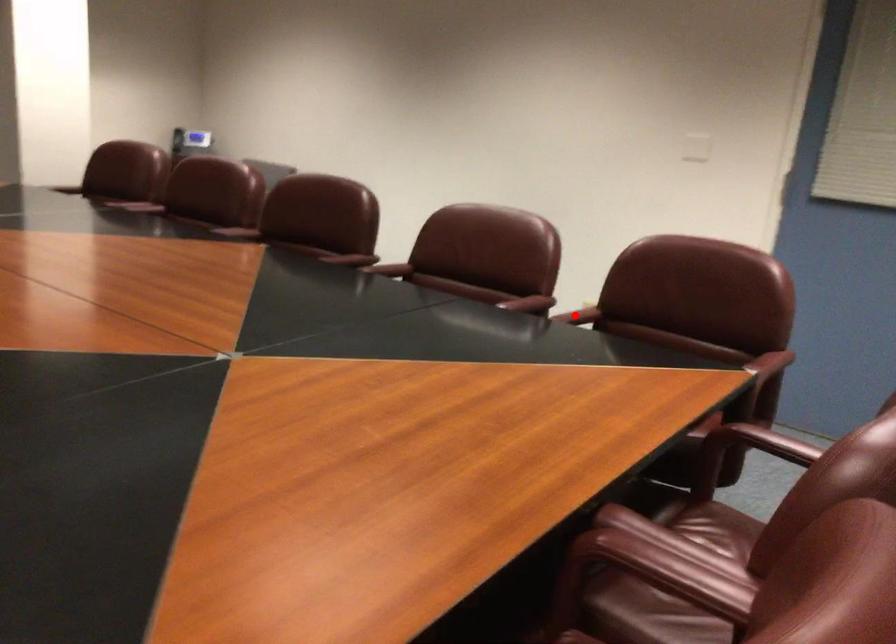
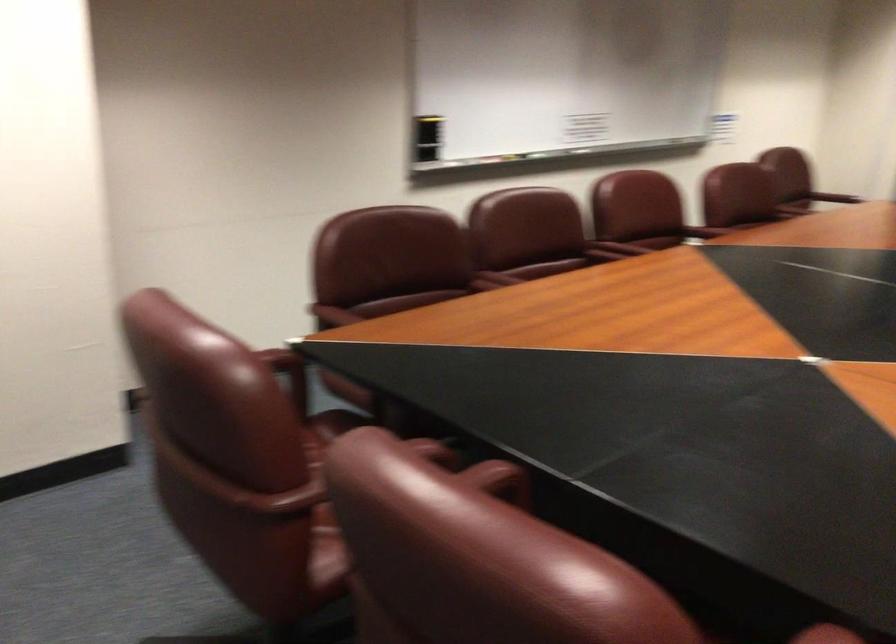
The point at the highlighted location is marked in the first image. Where is the corresponding point in the second image?

(433, 450)